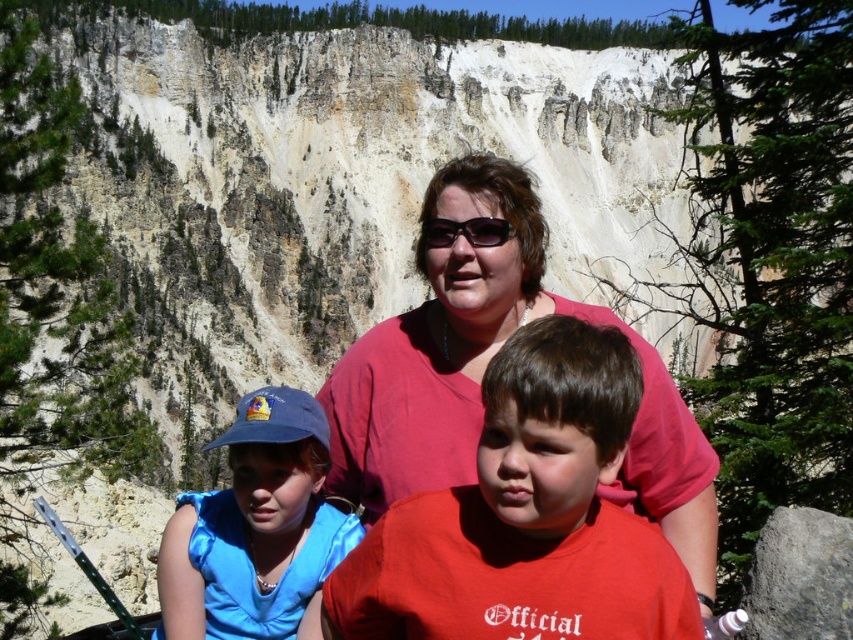
Looking at this image, you are a photographer trying to capture a clear shot of the red matte shirt at center and the matte black sunglasses at center. Since you want both to be visible, which object should you focus on to ensure the other remains in focus?

The red matte shirt at center is in front of matte black sunglasses at center. To ensure both are in focus, you should focus on the matte black sunglasses at center, as it is the farther object, and the red matte shirt at center will naturally be in focus as it is closer.

You are a photographer trying to capture a closeup shot of the blue satin cap at left and the matte black sunglasses at center. Given that your camera can only focus on objects within a 15 cm width limit, will both items fit within the frame?

The blue satin cap at left is wider than the matte black sunglasses at center. Since the camera can focus on objects within 15 cm width, and the blue satin cap at left is wider, it depends on the exact width of the cap. However, since the description only states the cap is wider but doesn

You are a photographer trying to capture a clear shot of the blue satin cap at left and the matte black sunglasses at center. Based on their heights, which object should you focus on first if you want to ensure both are in focus without adjusting your camera settings?

The blue satin cap at left is taller than matte black sunglasses at center, so you should focus on the taller blue satin cap at left first to ensure both are in focus.